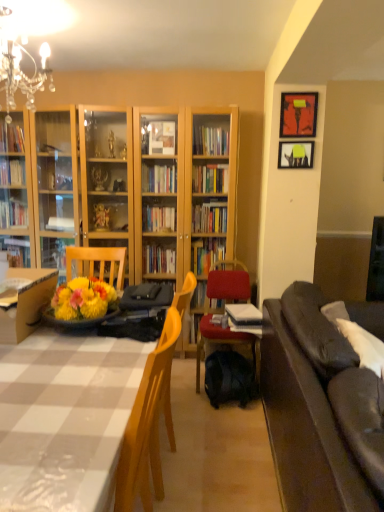
Question: Considering the positions of matte black picture frame at upper right, which is counted as the second picture frame, starting from the top, and wooden desk at lower left in the image, is matte black picture frame at upper right, which is counted as the second picture frame, starting from the top, wider or thinner than wooden desk at lower left?

Choices:
 (A) wide
 (B) thin

Answer: (B)

Question: From the image's perspective, is matte black picture frame at upper right, which is the 1th picture frame from bottom to top, above or below wooden desk at lower left?

Choices:
 (A) below
 (B) above

Answer: (B)

Question: Which object is positioned closest to the dark brown leather couch at right?

Choices:
 (A) black matte backpack at lower center
 (B) white paper stack at center
 (C) matte black picture frame at upper right, marked as the 1th picture frame in a top-to-bottom arrangement
 (D) velvet red chair at center
 (E) matte black picture frame at upper right, which is counted as the second picture frame, starting from the top

Answer: (B)

Question: Based on their relative distances, which object is farther from the wooden desk at lower left?

Choices:
 (A) black matte backpack at lower center
 (B) crystal chandelier at upper left
 (C) white paper stack at center
 (D) white checkered table at lower left
 (E) velvet red chair at center

Answer: (A)